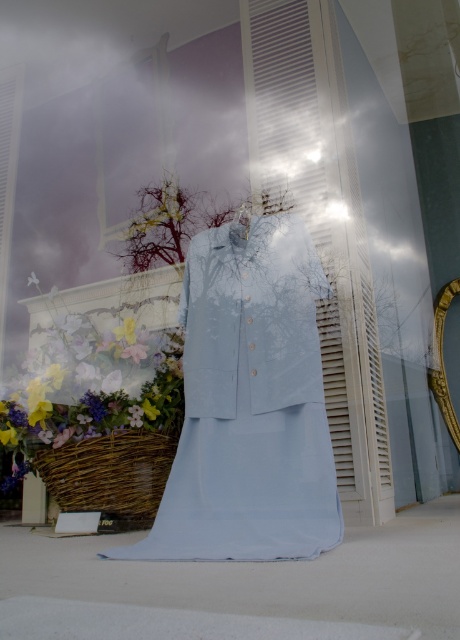
Does light blue fabric shirt at center appear on the left side of gold metallic mirror at right?

Yes, light blue fabric shirt at center is to the left of gold metallic mirror at right.

In the scene shown: Who is more forward, (208, 376) or (443, 288)?

Point (208, 376) is more forward.

At what (x,y) coordinates should I click in order to perform the action: click on light blue fabric shirt at center. Please return your answer as a coordinate pair (x, y). This screenshot has width=460, height=640. Looking at the image, I should click on (252, 316).

Can you confirm if pastel floral bouquet at center is bigger than woven brown basket at lower left?

Yes.

Describe the element at coordinates (96, 376) in the screenshot. I see `pastel floral bouquet at center` at that location.

Where is `pastel floral bouquet at center`? This screenshot has height=640, width=460. pastel floral bouquet at center is located at coordinates click(96, 376).

What do you see at coordinates (109, 472) in the screenshot?
I see `woven brown basket at lower left` at bounding box center [109, 472].

Is point (130, 461) positioned before point (30, 278)?

Yes, it is.

Is point (153, 435) more distant than point (32, 269)?

No, (153, 435) is in front of (32, 269).

This screenshot has width=460, height=640. I want to click on woven brown basket at lower left, so click(109, 472).